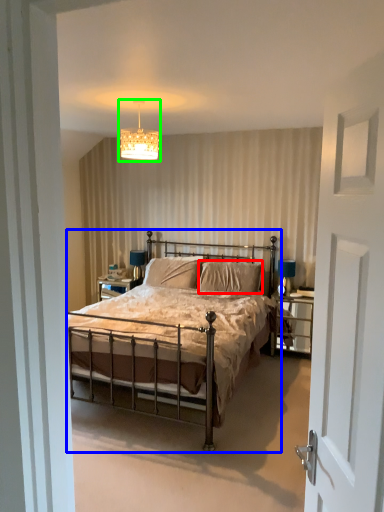
Question: Based on their relative distances, which object is nearer to pillow (highlighted by a red box)? Choose from bed (highlighted by a blue box) and light fixture (highlighted by a green box).

Choices:
 (A) bed
 (B) light fixture

Answer: (A)